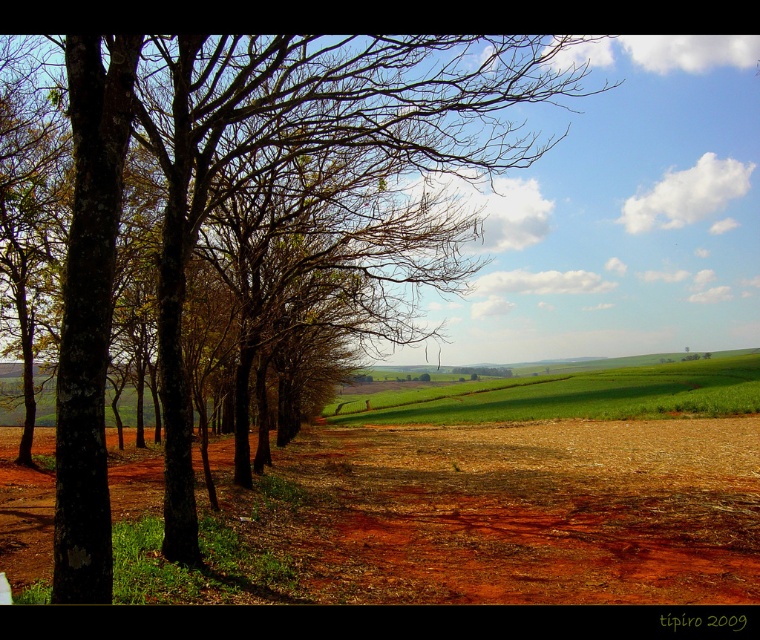
Question: Which object is closer to the camera taking this photo?

Choices:
 (A) brown dirt field at center
 (B) green grassy field at center
 (C) brown rough tree at left

Answer: (C)

Question: Which object is farther from the camera taking this photo?

Choices:
 (A) brown rough tree at left
 (B) green grassy field at center

Answer: (B)

Question: Can you confirm if brown rough tree at left is positioned above green grassy field at center?

Choices:
 (A) yes
 (B) no

Answer: (A)

Question: Can you confirm if brown dirt field at center is positioned above green grassy field at center?

Choices:
 (A) yes
 (B) no

Answer: (A)

Question: Is brown rough tree at left positioned at the back of green grassy field at center?

Choices:
 (A) no
 (B) yes

Answer: (A)

Question: Among these objects, which one is nearest to the camera?

Choices:
 (A) brown rough tree at left
 (B) brown dirt field at center

Answer: (A)